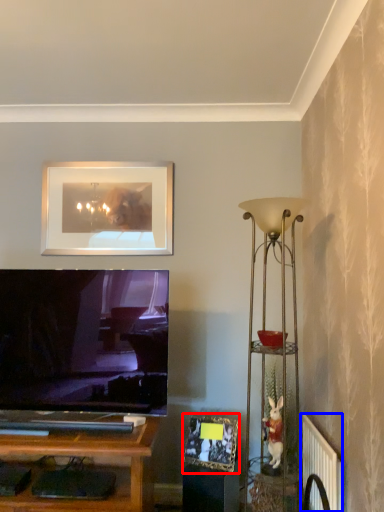
Question: Among these objects, which one is nearest to the camera, picture frame (highlighted by a red box) or radiator (highlighted by a blue box)?

Choices:
 (A) picture frame
 (B) radiator

Answer: (B)